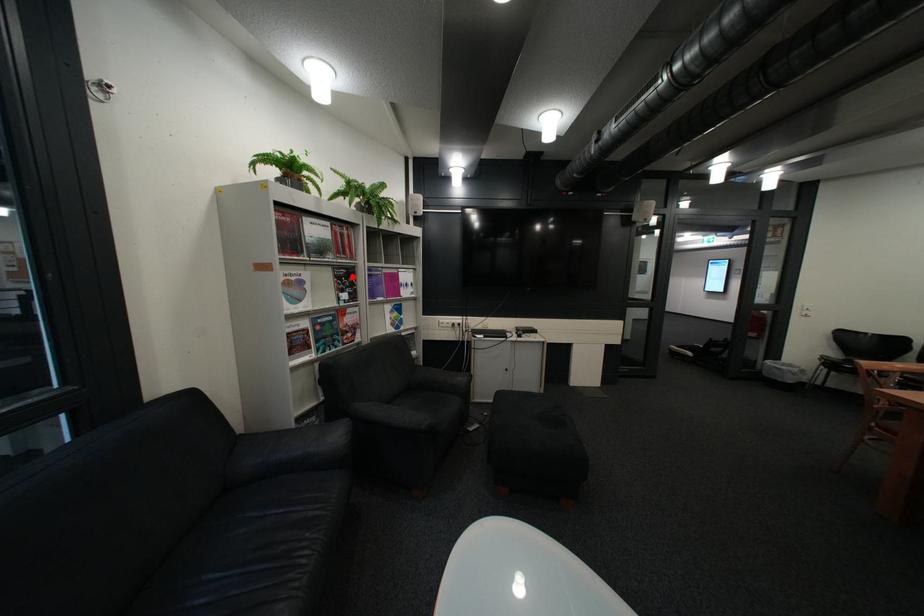
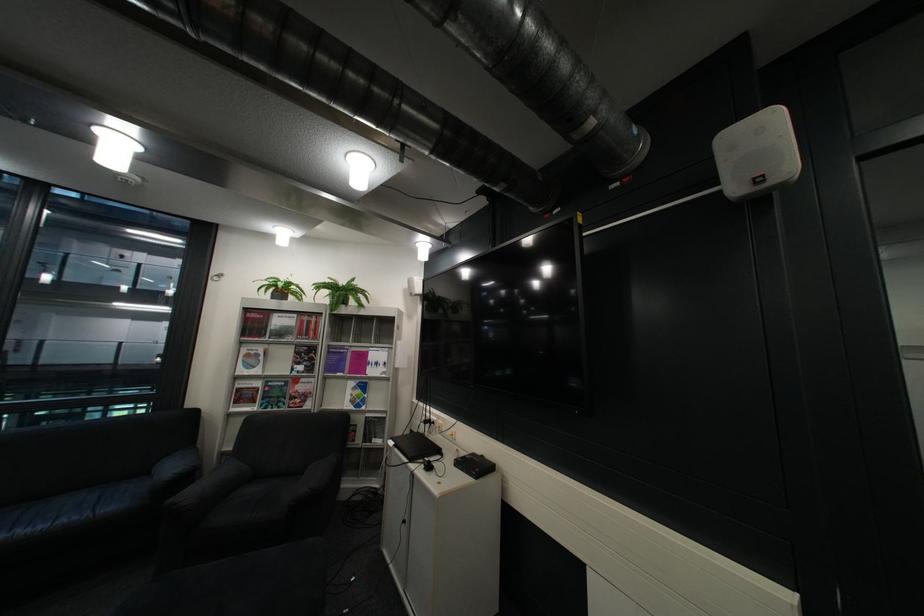
Question: I am providing you with two images of the same scene from different viewpoints. In image1, a red point is highlighted. Considering the same 3D point in image2, which of the following is correct?

Choices:
 (A) It is closer
 (B) It is farther

Answer: (B)